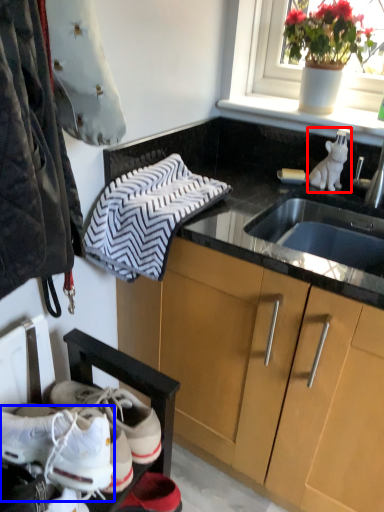
Question: Which point is further to the camera, animal (highlighted by a red box) or footwear (highlighted by a blue box)?

Choices:
 (A) animal
 (B) footwear

Answer: (A)